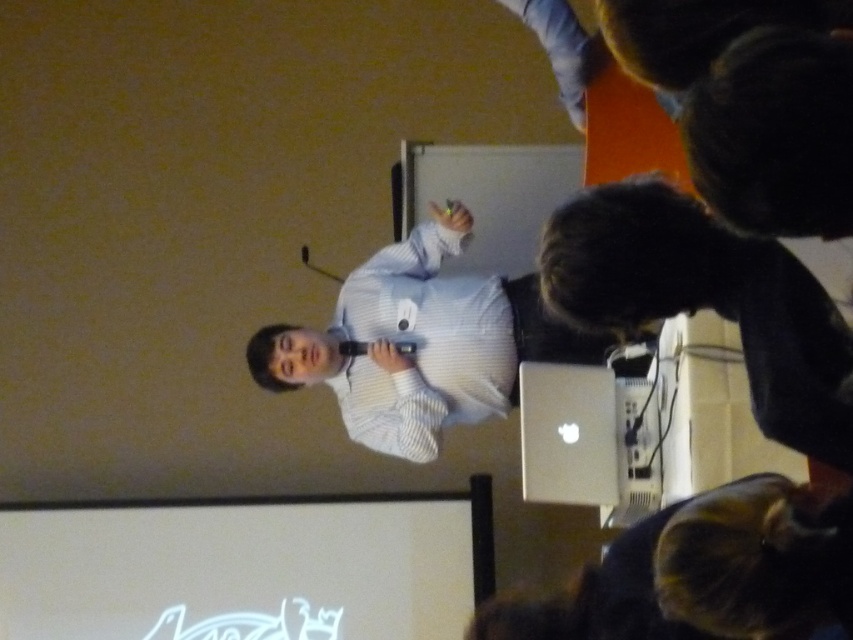
Consider the image. You are organizing a presentation and need to place a water bottle between the silver metallic laptop at lower right and the white striped shirt at center. Based on their positions, will the water bottle be closer to the laptop or the shirt?

The silver metallic laptop at lower right is in front of the white striped shirt at center, so placing the water bottle between them would position it closer to the laptop.

You are organizing a presentation and need to place your silver metallic laptop at lower right and white striped shirt at center. According to the scene, which object is located further to the right?

The silver metallic laptop at lower right is positioned over the white striped shirt at center, meaning it is further to the right.